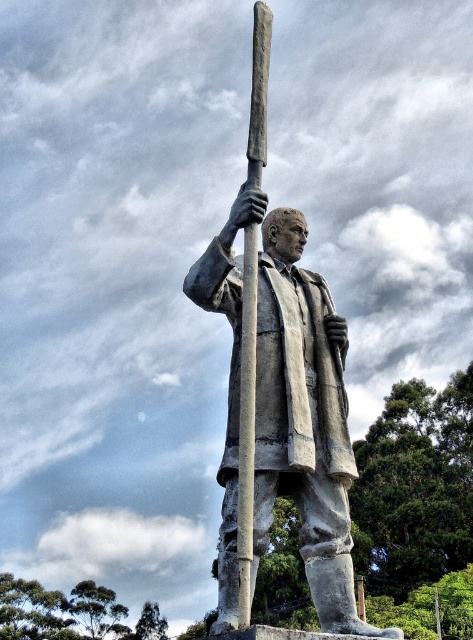
Does point (264, 518) come behind point (242, 515)?

That is True.

Between point (289, 448) and point (237, 502), which one is positioned in front?

Point (237, 502) is more forward.

What do you see at coordinates (280, 392) in the screenshot?
I see `bronze statue at center` at bounding box center [280, 392].

I want to click on bronze statue at center, so click(x=280, y=392).